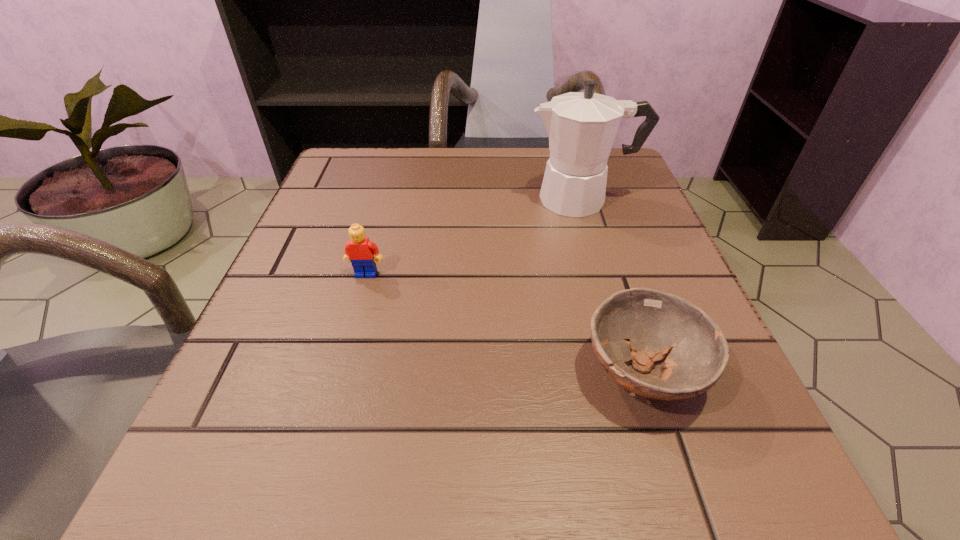
At what (x,y) coordinates should I click in order to perform the action: click on blank space at the far left corner. Please return your answer as a coordinate pair (x, y). The width and height of the screenshot is (960, 540). Looking at the image, I should click on (350, 158).

This screenshot has height=540, width=960. In order to click on vacant area at the near left corner of the desktop in this screenshot , I will do `click(270, 515)`.

You are a GUI agent. You are given a task and a screenshot of the screen. Output one action in this format:
    pyautogui.click(x=<x>, y=<y>)
    Task: Click on the free space at the far right corner of the desktop
    
    Given the screenshot: What is the action you would take?
    pyautogui.click(x=625, y=204)

Find the location of a particular element. The image size is (960, 540). vacant space at the near right corner of the desktop is located at coordinates (710, 499).

Locate an element on the screen. Image resolution: width=960 pixels, height=540 pixels. free space that is in between the bowl and the second shortest object is located at coordinates [504, 323].

Locate an element on the screen. The height and width of the screenshot is (540, 960). blank region between the Lego and the nearest object is located at coordinates (504, 323).

The height and width of the screenshot is (540, 960). What are the coordinates of `free space between the farthest object and the nearest object` in the screenshot? It's located at point(612,286).

Where is `vacant area that lies between the coffeepot and the second tallest object`? vacant area that lies between the coffeepot and the second tallest object is located at coordinates (474, 237).

Locate an element on the screen. The width and height of the screenshot is (960, 540). vacant space that is in between the leftmost object and the tallest object is located at coordinates (474, 237).

You are a GUI agent. You are given a task and a screenshot of the screen. Output one action in this format:
    pyautogui.click(x=<x>, y=<y>)
    Task: Click on the vacant space that's between the bowl and the tallest object
    This screenshot has height=540, width=960.
    Given the screenshot: What is the action you would take?
    pyautogui.click(x=612, y=286)